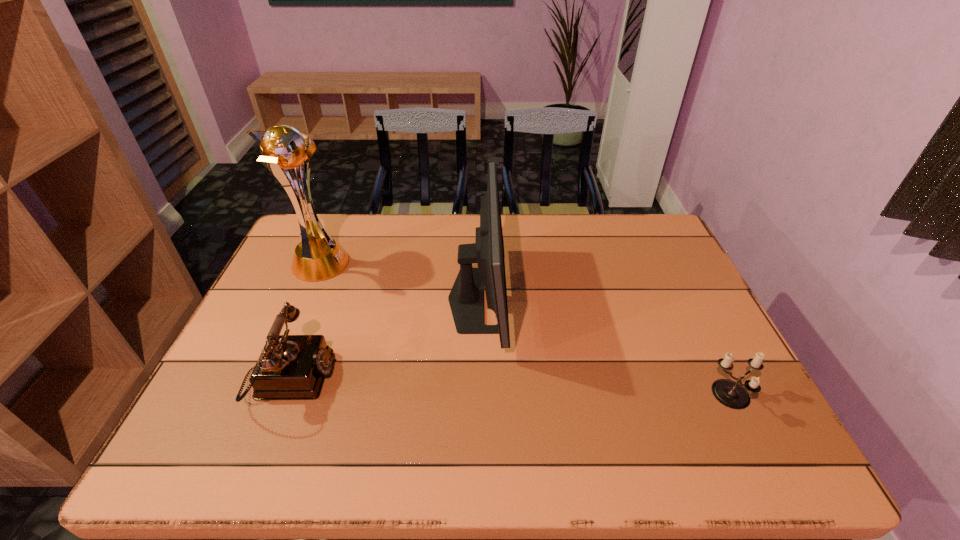
Image resolution: width=960 pixels, height=540 pixels. I want to click on free location that satisfies the following two spatial constraints: 1. on the back side of the candle holder; 2. on the dial of the second shortest object, so click(x=724, y=379).

The width and height of the screenshot is (960, 540). Identify the location of free spot that satisfies the following two spatial constraints: 1. on the screen side of the second object from right to left; 2. on the right side of the candle holder. (476, 396).